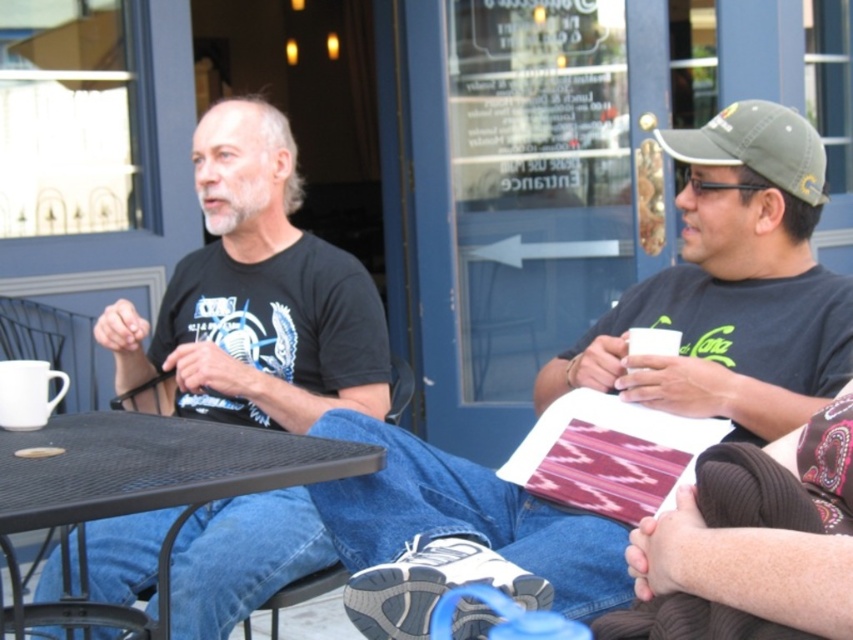
You are standing at the viewpoint of the image and want to walk towards the point labeled as point [103,460]. Which direction should you move relative to point [194,595]?

You should move forward towards point [103,460] because it is in front of point [194,595] from your current viewpoint.